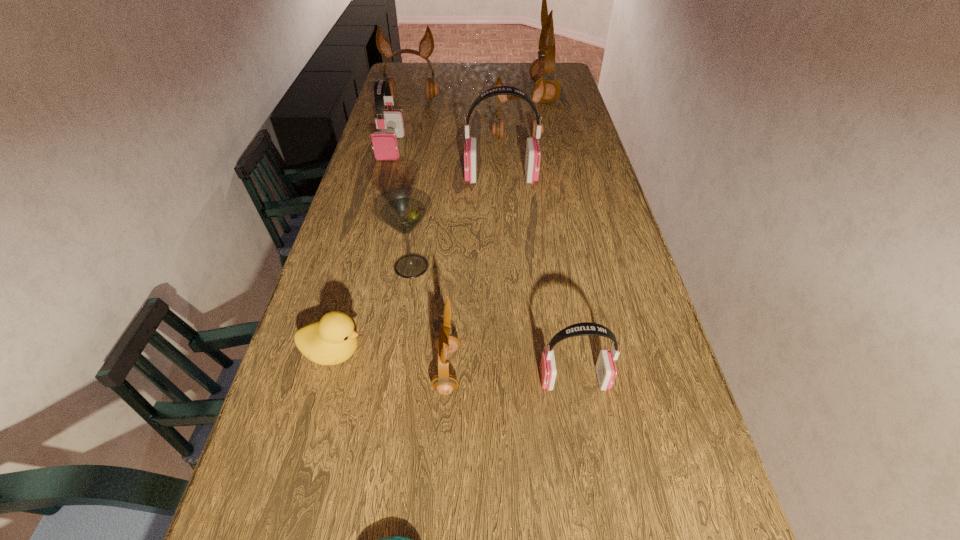
Locate an element on the screen. the tallest object is located at coordinates (544, 65).

The image size is (960, 540). I want to click on the biggest brown earphone, so 544,65.

Find the location of `the second biggest brown earphone`. the second biggest brown earphone is located at coordinates (426, 46).

You are a GUI agent. You are given a task and a screenshot of the screen. Output one action in this format:
    pyautogui.click(x=<x>, y=<y>)
    Task: Click on the fifth farthest earphone
    
    Given the screenshot: What is the action you would take?
    pyautogui.click(x=533, y=153)

The height and width of the screenshot is (540, 960). What are the coordinates of `the second farthest pink earphone` in the screenshot? It's located at (533, 153).

Identify the location of the second nearest brown earphone. (539, 93).

Locate an element on the screen. The height and width of the screenshot is (540, 960). the second smallest pink earphone is located at coordinates (385, 144).

At what (x,y) coordinates should I click in order to perform the action: click on the farthest pink earphone. Please return your answer as a coordinate pair (x, y). Looking at the image, I should click on (385, 144).

At what (x,y) coordinates should I click in order to perform the action: click on martini. Please return your answer as a coordinate pair (x, y). Looking at the image, I should click on (403, 208).

Locate an element on the screen. The width and height of the screenshot is (960, 540). the nearest brown earphone is located at coordinates (443, 382).